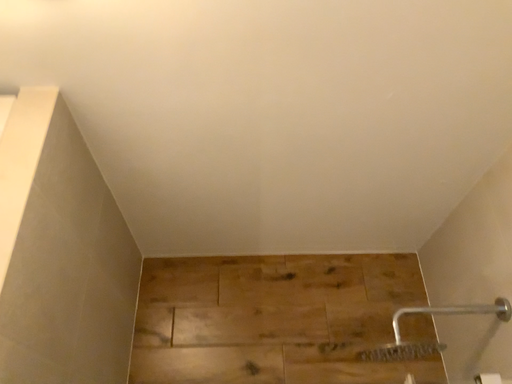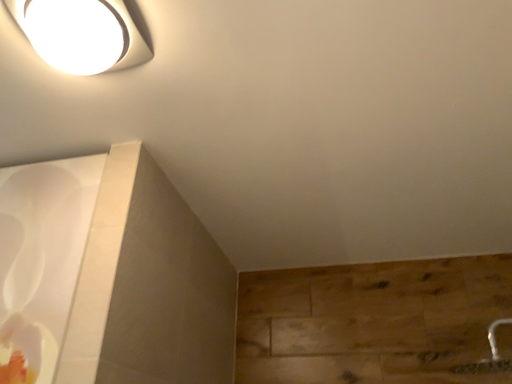
Question: Which way did the camera rotate in the video?

Choices:
 (A) rotated left
 (B) rotated right

Answer: (A)